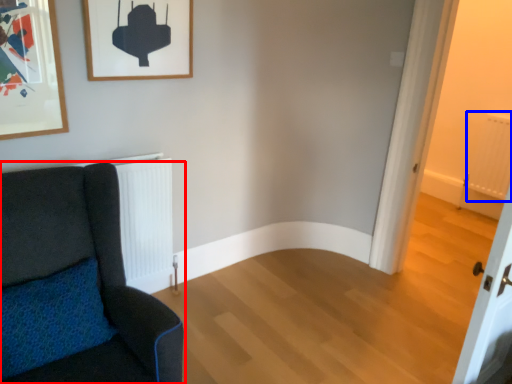
Question: Which of the following is the closest to the observer, chair (highlighted by a red box) or radiator (highlighted by a blue box)?

Choices:
 (A) chair
 (B) radiator

Answer: (A)